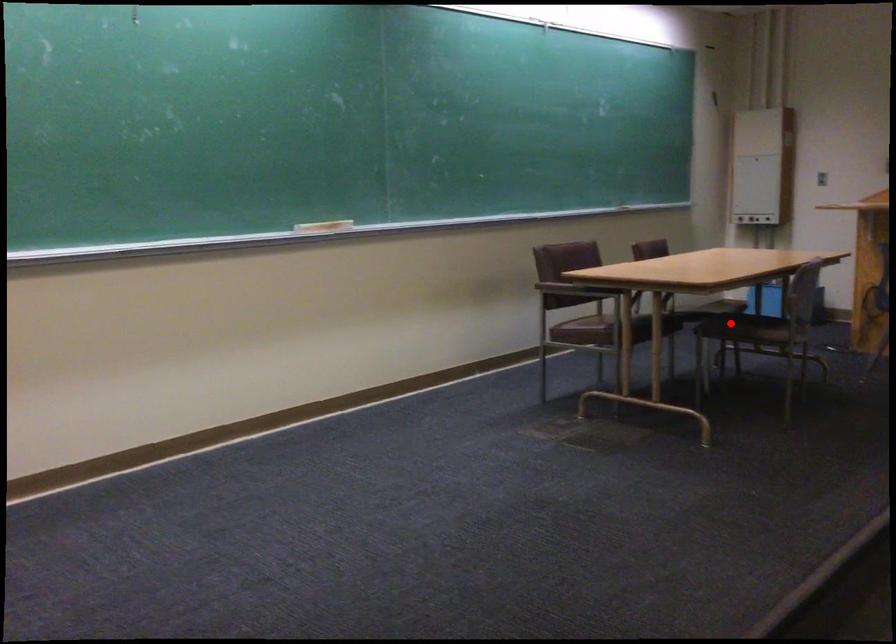
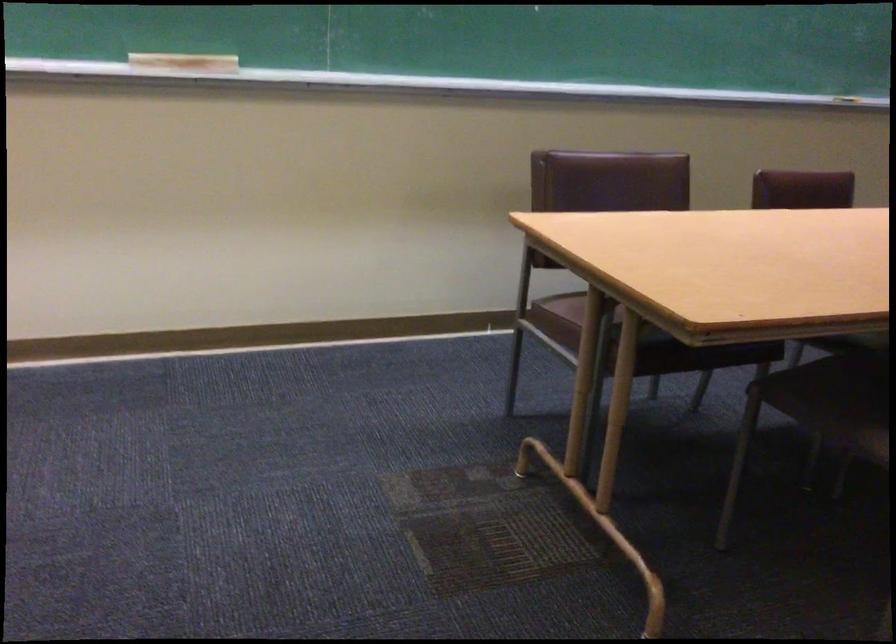
Locate, in the second image, the point that corresponds to the highlighted location in the first image.

(833, 391)